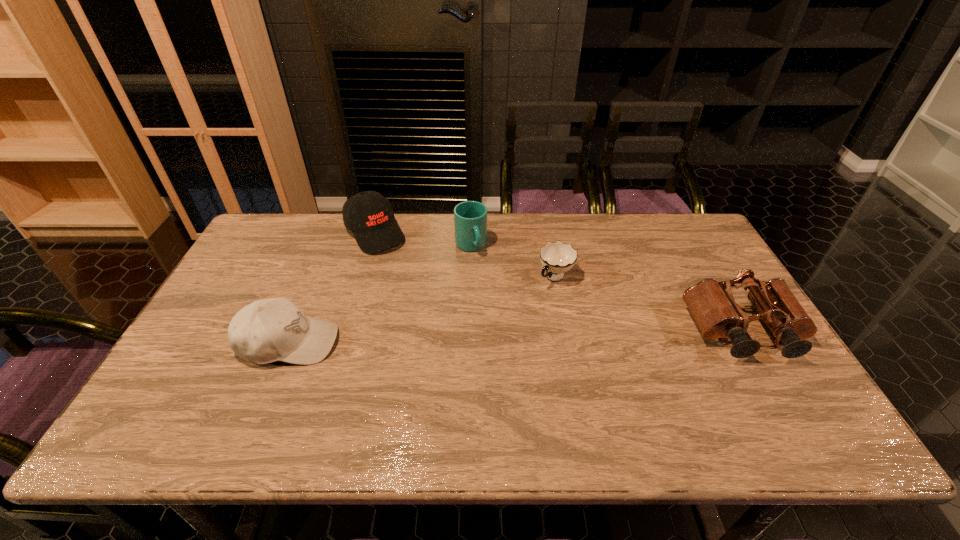
I want to click on blank area located on the side of the shorter cup with the handle, so click(492, 343).

Identify the location of vacant area located 0.110m on the front-facing side of the farther baseball cap. (403, 270).

Image resolution: width=960 pixels, height=540 pixels. Find the location of `free space located on the front-facing side of the farther baseball cap`. free space located on the front-facing side of the farther baseball cap is located at coordinates (426, 299).

Identify the location of blank space located on the front-facing side of the farther baseball cap. The image size is (960, 540). (416, 285).

Identify the location of free location located 0.190m on the handle side of the third object from right to left. (495, 298).

Where is `vacant space located 0.270m on the handle side of the third object from right to left`? The height and width of the screenshot is (540, 960). vacant space located 0.270m on the handle side of the third object from right to left is located at coordinates (505, 317).

At what (x,y) coordinates should I click in order to perform the action: click on vacant region located 0.270m on the handle side of the third object from right to left. Please return your answer as a coordinate pair (x, y). The image size is (960, 540). Looking at the image, I should click on (505, 317).

Locate an element on the screen. Image resolution: width=960 pixels, height=540 pixels. baseball cap located in the far edge section of the desktop is located at coordinates (369, 215).

You are a GUI agent. You are given a task and a screenshot of the screen. Output one action in this format:
    pyautogui.click(x=<x>, y=<y>)
    Task: Click on the cup located at the far edge
    
    Given the screenshot: What is the action you would take?
    pyautogui.click(x=470, y=217)

The width and height of the screenshot is (960, 540). In order to click on object that is at the left edge in this screenshot , I will do `click(268, 330)`.